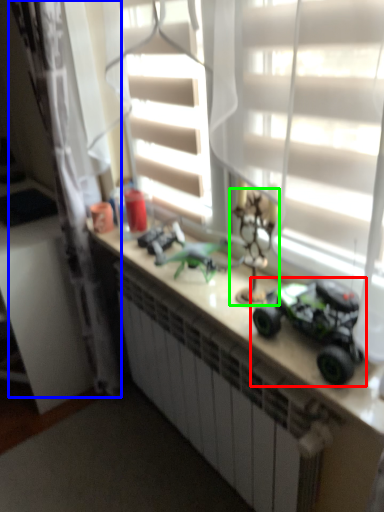
Question: Which object is positioned farthest from toy (highlighted by a red box)? Select from curtain (highlighted by a blue box) and toy (highlighted by a green box).

Choices:
 (A) curtain
 (B) toy

Answer: (A)